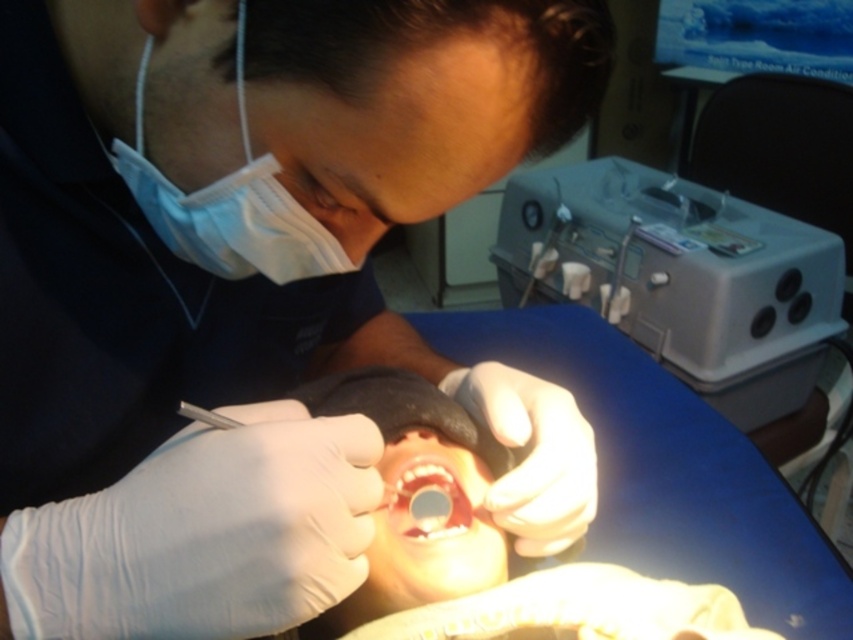
Question: Which of these objects is positioned closest to the white latex gloves at center?

Choices:
 (A) gray plastic machine at upper right
 (B) smooth pinkish flesh at center
 (C) blue disposable mask at upper left

Answer: (C)

Question: Is white latex gloves at center behind blue disposable mask at upper left?

Choices:
 (A) yes
 (B) no

Answer: (B)

Question: Which object is the farthest from the gray plastic machine at upper right?

Choices:
 (A) white latex gloves at center
 (B) smooth pinkish flesh at center
 (C) blue disposable mask at upper left

Answer: (C)

Question: Does blue disposable mask at upper left have a lesser width compared to smooth pinkish flesh at center?

Choices:
 (A) yes
 (B) no

Answer: (B)

Question: Does gray plastic machine at upper right appear on the left side of blue disposable mask at upper left?

Choices:
 (A) yes
 (B) no

Answer: (B)

Question: Which object is positioned farthest from the smooth pinkish flesh at center?

Choices:
 (A) gray plastic machine at upper right
 (B) white latex gloves at center

Answer: (A)